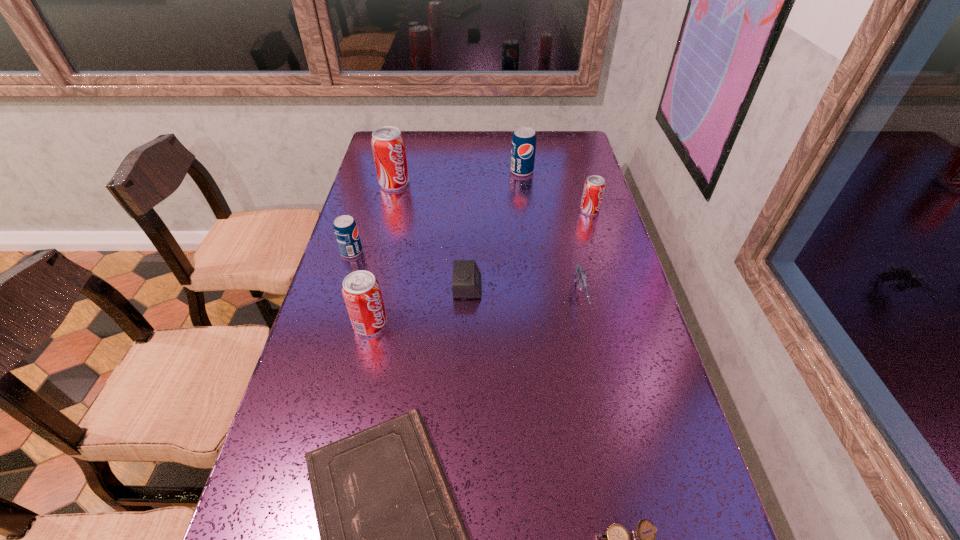
Identify the location of soda can that is at the right edge. This screenshot has width=960, height=540. (594, 186).

Where is `gun that is at the right edge`? The width and height of the screenshot is (960, 540). gun that is at the right edge is located at coordinates (579, 276).

Locate an element on the screen. Image resolution: width=960 pixels, height=540 pixels. vacant area at the far edge is located at coordinates (436, 160).

In the image, there is a desktop. What are the coordinates of `vacant space at the left edge` in the screenshot? It's located at (381, 195).

You are a GUI agent. You are given a task and a screenshot of the screen. Output one action in this format:
    pyautogui.click(x=<x>, y=<y>)
    Task: Click on the vacant position at the right edge of the desktop
    
    Given the screenshot: What is the action you would take?
    coord(575,234)

Where is `free space at the far right corner of the desktop`? free space at the far right corner of the desktop is located at coordinates (572, 139).

Identify the location of empty space that is in between the fourth pop from left to right and the tallest object. This screenshot has width=960, height=540. (458, 177).

This screenshot has height=540, width=960. I want to click on unoccupied position between the bigger blue pop and the seventh tallest object, so click(x=494, y=229).

This screenshot has width=960, height=540. Identify the location of free point between the second smallest red soda can and the sixth object from left to right. (446, 247).

Where is `empty location between the tallest object and the gun`? empty location between the tallest object and the gun is located at coordinates (487, 241).